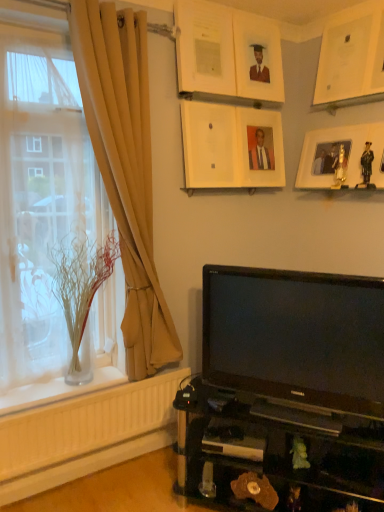
Question: In the image, is clear glass vase at left positioned in front of or behind clear glass vase at left?

Choices:
 (A) behind
 (B) front

Answer: (A)

Question: From the image's perspective, is clear glass vase at left positioned above or below clear glass vase at left?

Choices:
 (A) above
 (B) below

Answer: (B)

Question: Considering the real-world distances, which object is closest to the clear glass vase at left?

Choices:
 (A) beige fabric curtain at left
 (B) matte white picture frame at upper center, which is counted as the sixth picture frame, starting from the right
 (C) black glossy tv at lower right
 (D) matte white picture frame at upper center, the third picture frame from the left
 (E) white matte picture frame at upper right, which ranks as the first picture frame in right-to-left order

Answer: (A)

Question: Estimate the real-world distances between objects in this image. Which object is farther from the matte white picture frame at upper center, the third picture frame from the left?

Choices:
 (A) white matte picture frame at upper center, marked as the 2th picture frame in a left-to-right arrangement
 (B) matte white picture frame at upper center, the 1th picture frame viewed from the left
 (C) wooden photo frame at upper right, positioned as the fifth picture frame in left-to-right order
 (D) clear glass vase at left
 (E) white matte picture frame at upper right, which ranks as the 6th picture frame in left-to-right order

Answer: (D)